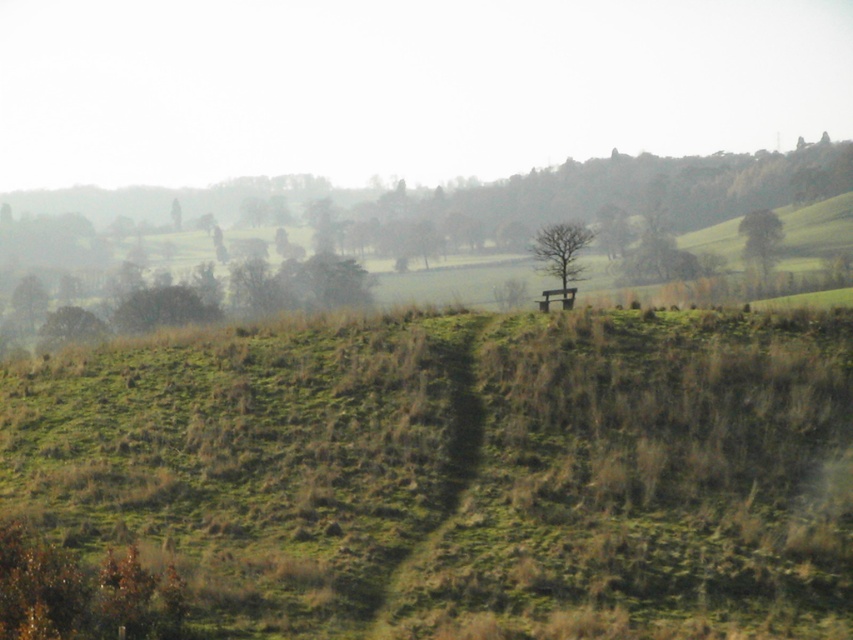
You are a hiker standing at the bottom of the green grassy hill at upper center. You see the green leafy tree at upper right in the distance. Which object is taller?

The green leafy tree at upper right is taller than the green grassy hill at upper center according to the description.

You are standing on the hill in the foreground and want to walk towards the midground. Which direction should you head to first reach the green grassy tree at left before the bare wood tree at center?

You should head to the left because the green grassy tree at left is positioned to the left of the bare wood tree at center, so it will come first in that direction.

Where is the bare wood tree at center located in the image?

The bare wood tree at center is located at point [560,257].